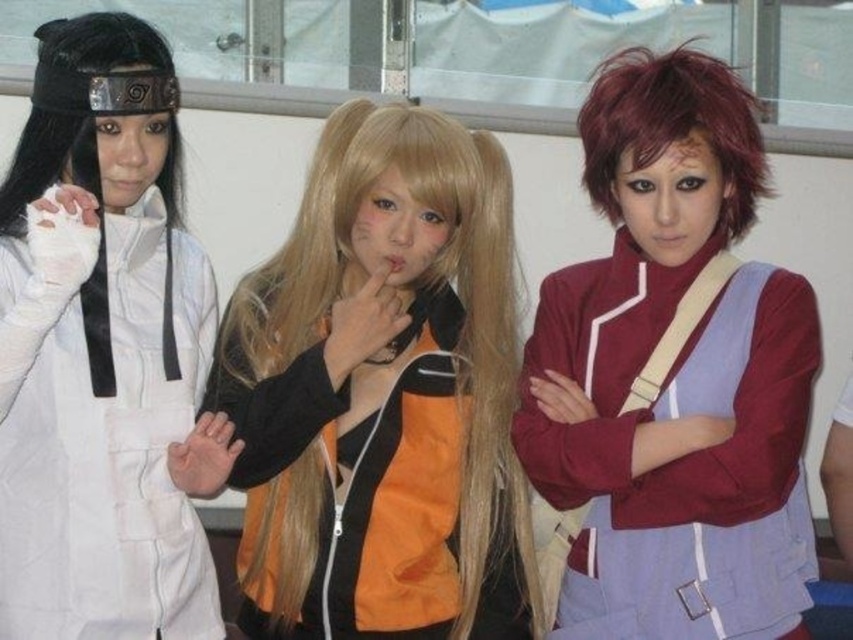
Does maroon fabric jacket at center have a greater width compared to short red hair at center?

Indeed, maroon fabric jacket at center has a greater width compared to short red hair at center.

Does maroon fabric jacket at center have a lesser height compared to short red hair at center?

Incorrect, maroon fabric jacket at center's height does not fall short of short red hair at center's.

Does point (540, 461) lie behind point (705, 108)?

Yes, it is.

The height and width of the screenshot is (640, 853). What are the coordinates of `maroon fabric jacket at center` in the screenshot? It's located at tap(677, 458).

Looking at this image, is shiny orange jacket at center above maroon fabric jacket at center?

Yes.

Is point (335, 406) positioned in front of point (654, 579)?

That is False.

Identify the location of shiny orange jacket at center. This screenshot has height=640, width=853. (383, 396).

Looking at this image, is white matte glove at left above short red hair at center?

No.

Measure the distance between point (115, 314) and camera.

They are 3.45 meters apart.

Where is `white matte glove at left`? The image size is (853, 640). white matte glove at left is located at coordinates (100, 435).